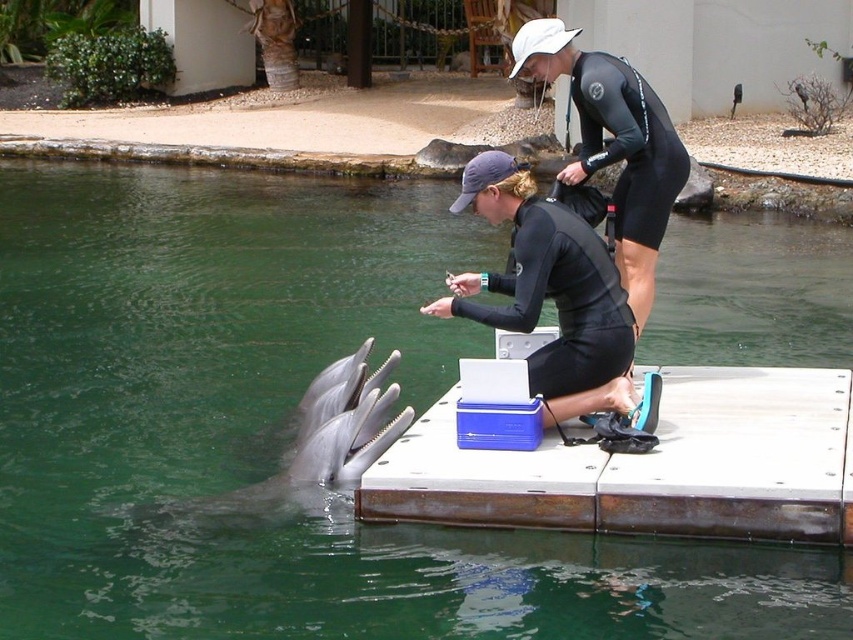
Question: Does white wood dock at center appear on the left side of black wetsuit at upper center?

Choices:
 (A) yes
 (B) no

Answer: (B)

Question: Which object is closer to the camera taking this photo?

Choices:
 (A) black matte wetsuit at center
 (B) gray smooth dolphin at lower left
 (C) black wetsuit at upper center
 (D) black matte wetsuit at upper center

Answer: (A)

Question: Is black matte wetsuit at center positioned at the back of gray smooth dolphin at lower left?

Choices:
 (A) no
 (B) yes

Answer: (A)

Question: Among these objects, which one is nearest to the camera?

Choices:
 (A) black wetsuit at upper center
 (B) black matte wetsuit at center
 (C) gray smooth dolphin at lower left
 (D) black matte wetsuit at upper center

Answer: (B)

Question: Which point appears farthest from the camera in this image?

Choices:
 (A) (599, 115)
 (B) (520, 310)
 (C) (705, 387)

Answer: (C)

Question: Does black wetsuit at upper center come in front of black matte wetsuit at upper center?

Choices:
 (A) yes
 (B) no

Answer: (A)